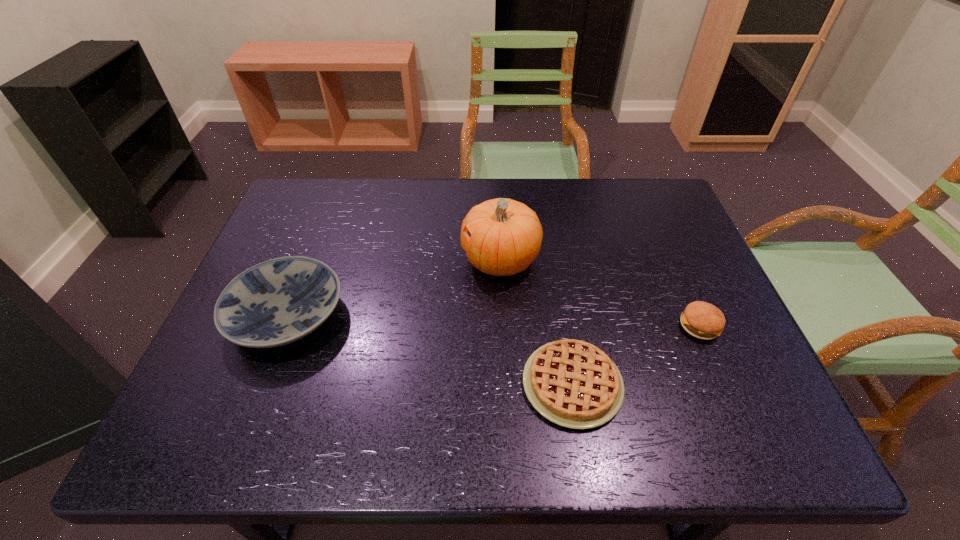
Identify the location of the tallest object. (506, 235).

This screenshot has width=960, height=540. I want to click on plate, so click(x=274, y=303).

Locate an element on the screen. The height and width of the screenshot is (540, 960). the leftmost object is located at coordinates (274, 303).

Find the location of a particular element. the second shortest object is located at coordinates (702, 320).

Find the location of a particular element. This screenshot has height=540, width=960. hamburger is located at coordinates (702, 320).

Find the location of `pie`. pie is located at coordinates (572, 383).

Identify the location of vacant position located 0.280m on the front-facing side of the tallest object. The width and height of the screenshot is (960, 540). (357, 260).

Where is `vacant space located on the front-facing side of the tallest object`? This screenshot has height=540, width=960. vacant space located on the front-facing side of the tallest object is located at coordinates (361, 260).

Identify the location of free space located on the front-facing side of the tallest object. The width and height of the screenshot is (960, 540). (402, 260).

Find the location of a particular element. This screenshot has width=960, height=540. blank space located on the right of the plate is located at coordinates pos(366,316).